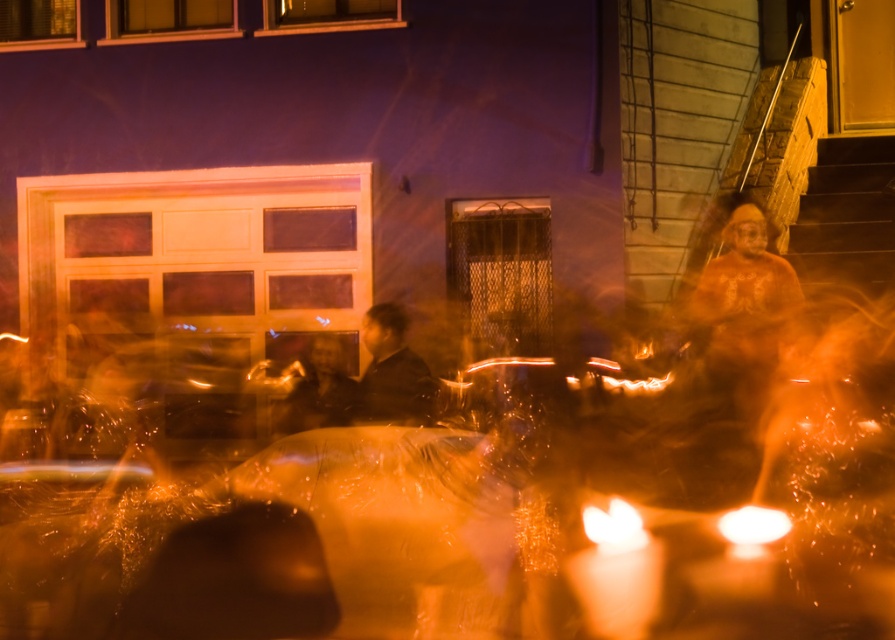
Question: Which is nearer to the matte orange candle at lower right?

Choices:
 (A) matte bronze statue at right
 (B) orange translucent light at center
 (C) dark brown leather jacket at center
 (D) smooth black jacket at center

Answer: (B)

Question: Which is nearer to the dark brown leather jacket at center?

Choices:
 (A) smooth black jacket at center
 (B) matte orange candle at lower right

Answer: (A)

Question: Which object is the closest to the matte orange candle at lower right?

Choices:
 (A) orange translucent light at center
 (B) dark brown leather jacket at center

Answer: (A)

Question: In this image, where is matte bronze statue at right located relative to dark brown leather jacket at center?

Choices:
 (A) right
 (B) left

Answer: (A)

Question: Is matte bronze statue at right smaller than matte orange candle at lower right?

Choices:
 (A) yes
 (B) no

Answer: (B)

Question: Where is smooth black jacket at center located in relation to matte orange candle at lower right in the image?

Choices:
 (A) below
 (B) above

Answer: (B)